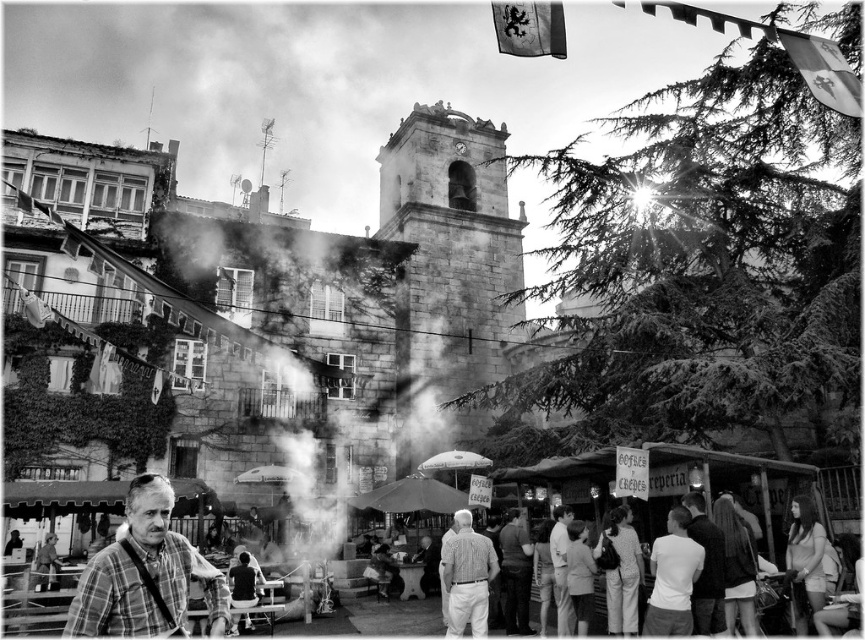
Which is more to the left, plaid shirt at lower left or striped shirt at center?

Positioned to the left is plaid shirt at lower left.

The height and width of the screenshot is (640, 865). What are the coordinates of `plaid shirt at lower left` in the screenshot? It's located at (145, 573).

Identify the location of plaid shirt at lower left. This screenshot has height=640, width=865. (145, 573).

What do you see at coordinates (466, 577) in the screenshot?
I see `striped shirt at center` at bounding box center [466, 577].

Measure the distance between point (x=465, y=595) and camera.

The distance of point (x=465, y=595) from camera is 58.22 meters.

Identify the location of striped shirt at center. The height and width of the screenshot is (640, 865). (466, 577).

Can you confirm if plaid shirt at lower left is positioned to the right of white matte umbrella at center?

In fact, plaid shirt at lower left is to the left of white matte umbrella at center.

Which is behind, point (100, 564) or point (459, 452)?

The point (459, 452) is behind.

The height and width of the screenshot is (640, 865). Identify the location of plaid shirt at lower left. (145, 573).